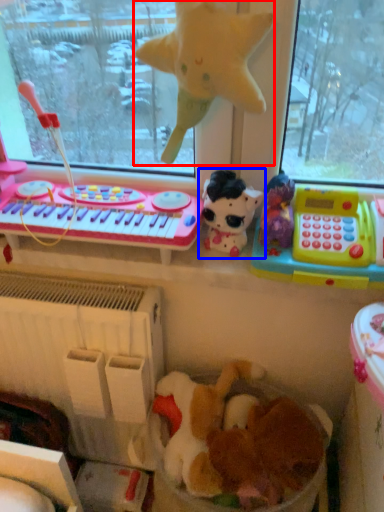
Question: Among these objects, which one is nearest to the camera, toy (highlighted by a red box) or toy (highlighted by a blue box)?

Choices:
 (A) toy
 (B) toy

Answer: (A)